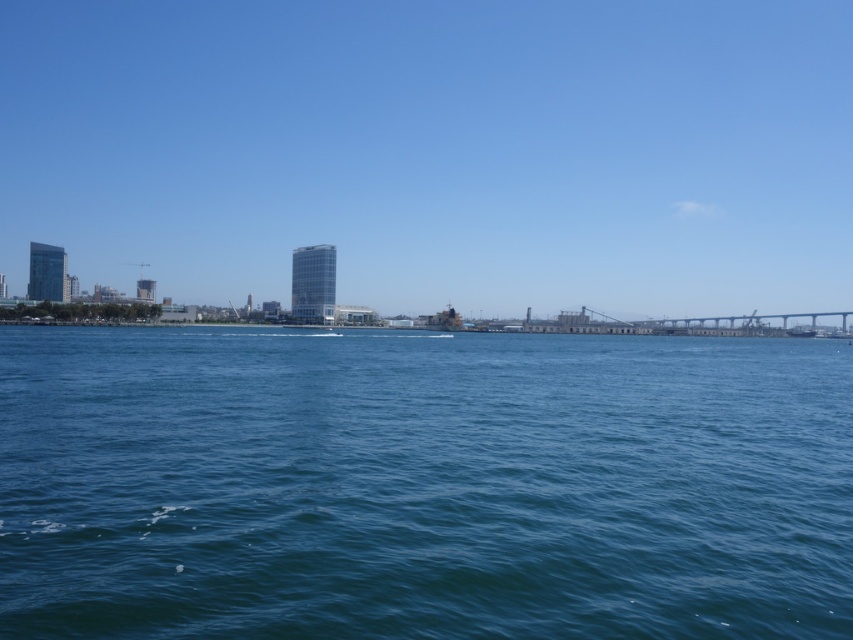
You are a drone operator who needs to fly a drone between the transparent glass skyscraper at center and the concrete gray bridge at right. The drone has a maximum flight distance of 100 meters. Can the drone safely make the trip without needing to recharge?

The transparent glass skyscraper at center and concrete gray bridge at right are 103.82 meters apart from each other. Since the drone can only fly up to 100 meters without recharging, it cannot safely make the trip without needing to recharge.

You are a photographer planning to capture the entire scene of the blue water at center and the concrete gray bridge at right in one shot. Based on their relative sizes in the image, which object would appear smaller in the final photograph?

The blue water at center appears smaller than the concrete gray bridge at right in the image because it is shorter in height.

You are a bird flying over the bay and want to land on the blue water at center. Considering the height of the transparent glass skyscraper at center, do you think you can safely descend without hitting any obstacles?

The transparent glass skyscraper at center is taller than the blue water at center. Since the skyscraper is taller, you would need to navigate around it to avoid collision. However, the blue water at center is lower, so if you descend carefully below the skyscraper, you might find a safe landing spot.